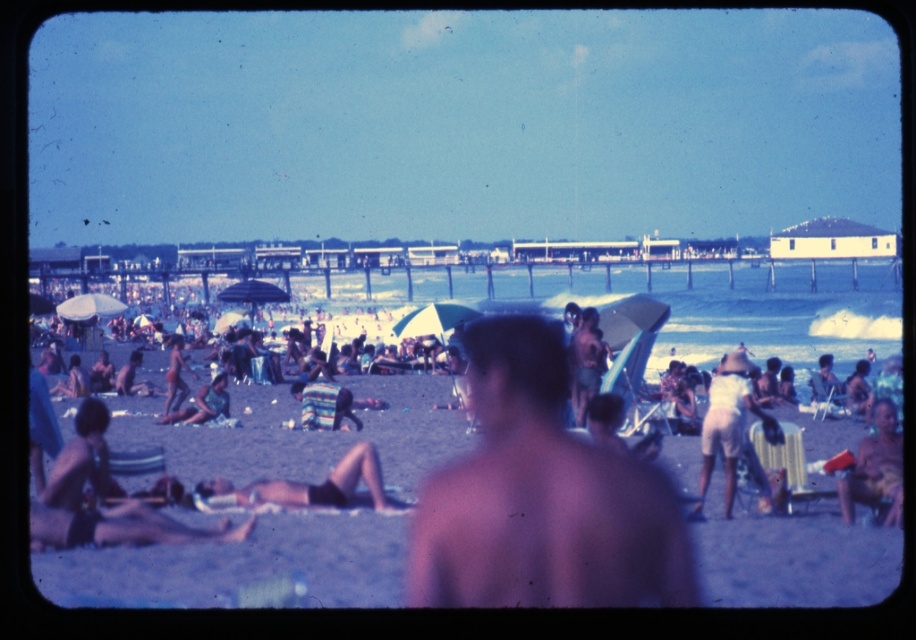
Does smooth skin back at center come behind striped fabric towel at center?

That is False.

Can you confirm if smooth skin back at center is bigger than striped fabric towel at center?

Yes, smooth skin back at center is bigger than striped fabric towel at center.

Where is `smooth skin back at center`? The height and width of the screenshot is (640, 916). smooth skin back at center is located at coordinates (541, 497).

Can you confirm if orange fabric shorts at lower right is positioned above tan skin person at center?

No.

The width and height of the screenshot is (916, 640). Find the location of `orange fabric shorts at lower right`. orange fabric shorts at lower right is located at coordinates click(x=875, y=467).

Which is more to the left, matte white umbrella at center or tan skin person at center?

tan skin person at center

Can you confirm if matte white umbrella at center is smaller than tan skin person at center?

No.

Locate an element on the screen. This screenshot has width=916, height=640. matte white umbrella at center is located at coordinates (759, 420).

Identify the location of matte white umbrella at center. Image resolution: width=916 pixels, height=640 pixels. (759, 420).